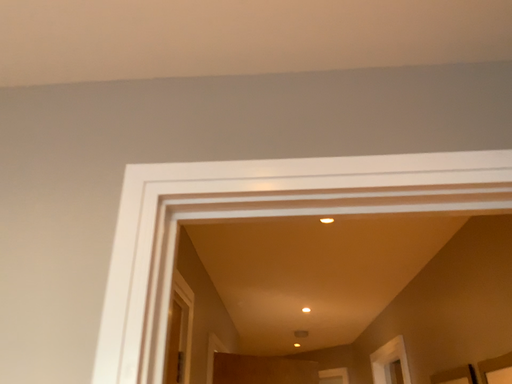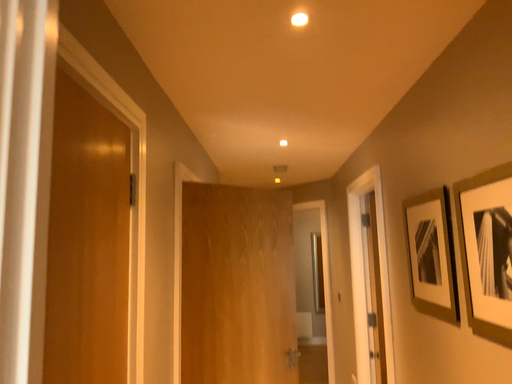
Question: Which way did the camera rotate in the video?

Choices:
 (A) rotated upward
 (B) rotated downward

Answer: (B)